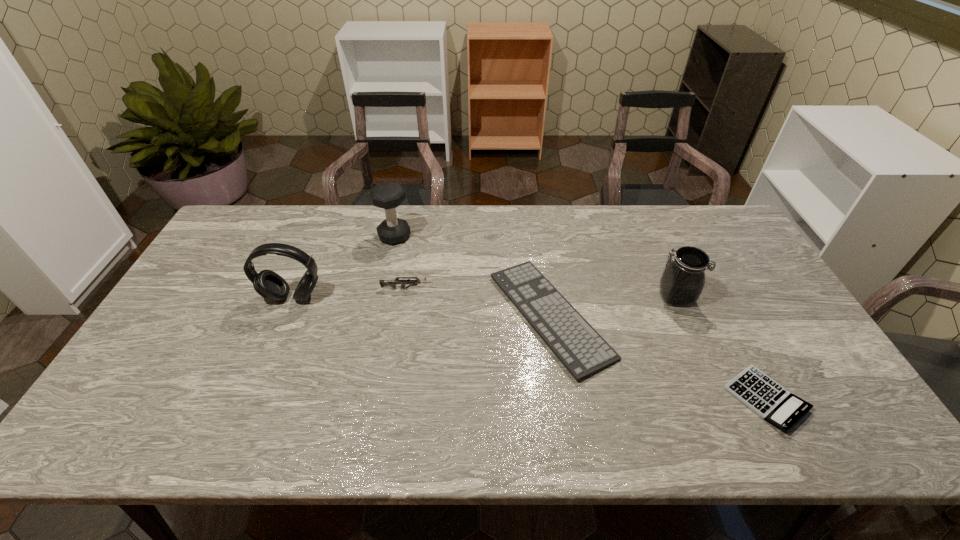
Find the location of a particular element. This screenshot has height=540, width=960. the leftmost object is located at coordinates (268, 284).

You are a GUI agent. You are given a task and a screenshot of the screen. Output one action in this format:
    pyautogui.click(x=<x>, y=<y>)
    Task: Click on the dumbbell
    This screenshot has width=960, height=540.
    Given the screenshot: What is the action you would take?
    pyautogui.click(x=388, y=195)

I want to click on the third tallest object, so click(683, 279).

You are a GUI agent. You are given a task and a screenshot of the screen. Output one action in this format:
    pyautogui.click(x=<x>, y=<y>)
    Task: Click on the fourth tallest object
    
    Given the screenshot: What is the action you would take?
    pyautogui.click(x=392, y=283)

This screenshot has height=540, width=960. Identify the location of the fourth object from left to right. (581, 349).

Where is `calculator`? The height and width of the screenshot is (540, 960). calculator is located at coordinates (768, 399).

Where is `free space located on the earcups of the leftmost object`? Image resolution: width=960 pixels, height=540 pixels. free space located on the earcups of the leftmost object is located at coordinates (266, 362).

Locate an element on the screen. The height and width of the screenshot is (540, 960). vacant region located 0.300m on the left of the farthest object is located at coordinates (290, 236).

Image resolution: width=960 pixels, height=540 pixels. In order to click on vacant space located 0.230m on the lid of the third tallest object in this screenshot , I will do `click(578, 297)`.

You are a GUI agent. You are given a task and a screenshot of the screen. Output one action in this format:
    pyautogui.click(x=<x>, y=<y>)
    Task: Click on the free space located on the lid of the third tallest object
    
    Given the screenshot: What is the action you would take?
    pyautogui.click(x=622, y=297)